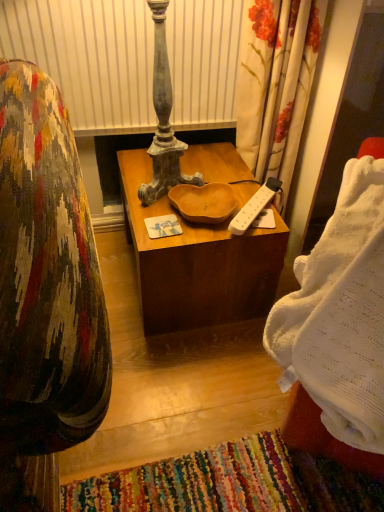
Question: From a real-world perspective, is white knitted blanket at right positioned above or below wooden at center?

Choices:
 (A) below
 (B) above

Answer: (B)

Question: Is white knitted blanket at right taller or shorter than wooden at center?

Choices:
 (A) tall
 (B) short

Answer: (A)

Question: Based on their relative distances, which object is farther from the white knitted blanket at right?

Choices:
 (A) white plastic power strip at center
 (B) wooden at center

Answer: (B)

Question: Considering the real-world distances, which object is farthest from the wooden at center?

Choices:
 (A) white knitted blanket at right
 (B) white plastic power strip at center

Answer: (A)